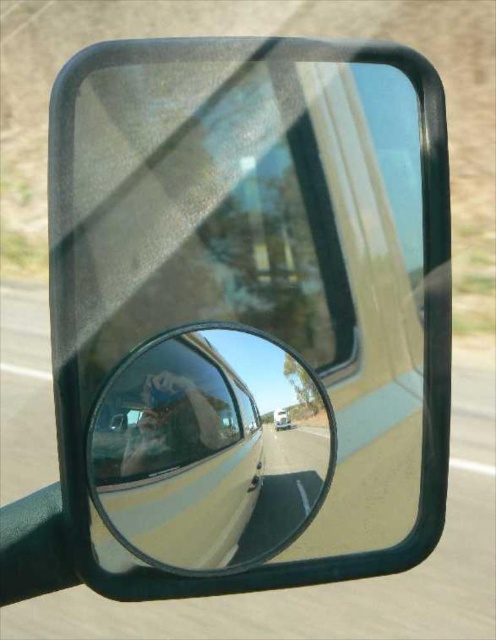
You are a mechanic inspecting a truck and notice a specific point on the side mirror at coordinates point (97,388). The truck requires a repair that needs access to parts within 30 centimeters of the viewer. Can you reach that point for the repair?

The point (97,388) is 35.41 centimeters from the viewer, which is beyond the 30 centimeter reach required for the repair. Therefore, the mechanic cannot reach that point for the repair.

You are a driver checking the side mirrors of your truck. You notice a clear glass mirror at center. Where is it positioned relative to the convex mirror attached to it?

The clear glass mirror at center is located at point (209,449), which is to the right and slightly above the convex mirror attached to it.